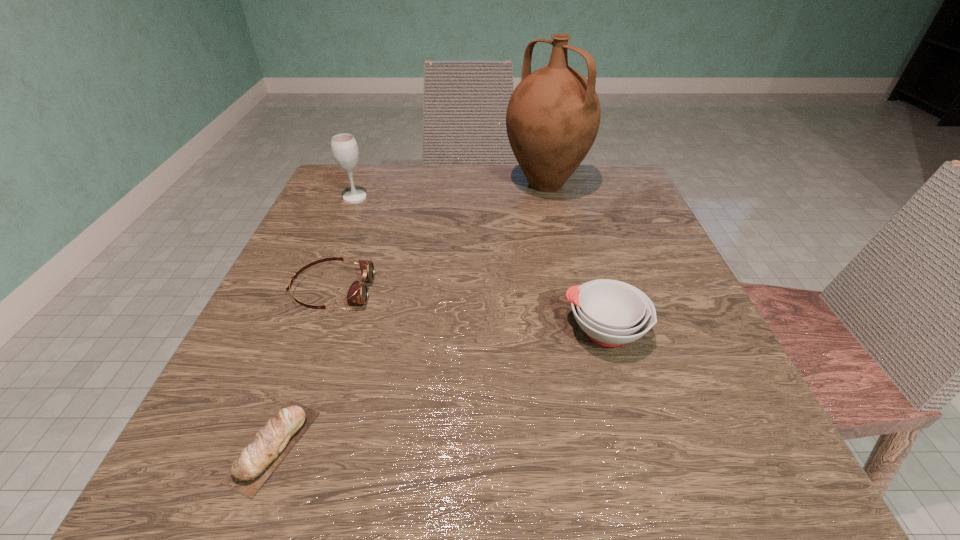
Identify which object is the third nearest to the fourth shortest object. Please provide its 2D coordinates. Your answer should be formatted as a tuple, i.e. [(x, y)], where the tuple contains the x and y coordinates of a point satisfying the conditions above.

[(612, 313)]

This screenshot has width=960, height=540. Find the location of `free point that satisfies the following two spatial constraints: 1. on the back side of the shortest object; 2. on the right side of the soup bowl`. free point that satisfies the following two spatial constraints: 1. on the back side of the shortest object; 2. on the right side of the soup bowl is located at coordinates (316, 330).

This screenshot has height=540, width=960. Identify the location of vacant point that satisfies the following two spatial constraints: 1. on the back side of the soup bowl; 2. through the lenses of the goggles. (593, 291).

Locate an element on the screen. vacant space that satisfies the following two spatial constraints: 1. through the lenses of the third tallest object; 2. on the left side of the goggles is located at coordinates (318, 330).

I want to click on vacant space that satisfies the following two spatial constraints: 1. on the front side of the second tallest object; 2. on the left side of the nearest object, so click(x=253, y=446).